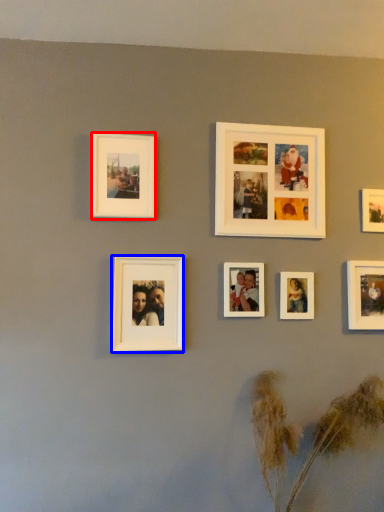
Question: Which of the following is the farthest to the observer, picture frame (highlighted by a red box) or picture frame (highlighted by a blue box)?

Choices:
 (A) picture frame
 (B) picture frame

Answer: (A)